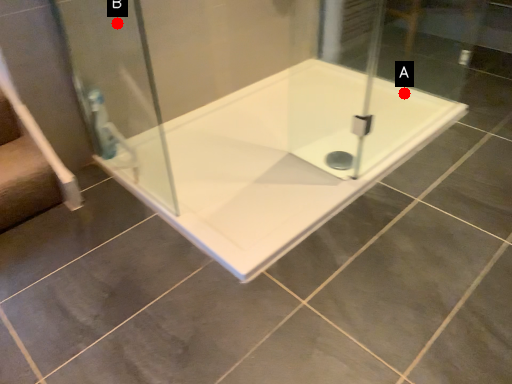
Question: Two points are circled on the image, labeled by A and B beside each circle. Among these points, which one is nearest to the camera?

Choices:
 (A) A is closer
 (B) B is closer

Answer: (B)